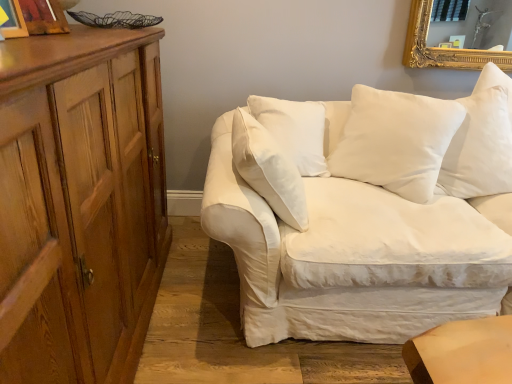
Question: Is white cotton pillow at center, acting as the first pillow starting from the left, completely or partially outside of wooden picture frame at upper left, the 1th picture frame in the front-to-back sequence?

Choices:
 (A) yes
 (B) no

Answer: (A)

Question: Is white cotton pillow at center, the 2th pillow from the right, beside wooden picture frame at upper left, acting as the second picture frame starting from the back?

Choices:
 (A) yes
 (B) no

Answer: (B)

Question: Does white cotton pillow at center, the 2th pillow from the right, have a lesser width compared to wooden picture frame at upper left, the 1th picture frame in the front-to-back sequence?

Choices:
 (A) no
 (B) yes

Answer: (A)

Question: Is white cotton pillow at center, acting as the first pillow starting from the left, further to the viewer compared to wooden picture frame at upper left, acting as the second picture frame starting from the back?

Choices:
 (A) no
 (B) yes

Answer: (B)

Question: Is white cotton pillow at center, acting as the first pillow starting from the left, oriented towards wooden picture frame at upper left, the 1th picture frame in the front-to-back sequence?

Choices:
 (A) yes
 (B) no

Answer: (A)

Question: Does white cotton pillow at center, acting as the first pillow starting from the left, contain wooden picture frame at upper left, the 1th picture frame in the front-to-back sequence?

Choices:
 (A) no
 (B) yes

Answer: (A)

Question: Is white soft pillow at upper right, the 2th pillow in the left-to-right sequence, inside wooden picture frame at upper left, the 1th picture frame when ordered from back to front?

Choices:
 (A) no
 (B) yes

Answer: (A)

Question: Are wooden picture frame at upper left, the 1th picture frame when ordered from back to front, and white soft pillow at upper right, the 2th pillow in the left-to-right sequence, beside each other?

Choices:
 (A) yes
 (B) no

Answer: (B)

Question: Considering the relative sizes of wooden picture frame at upper left, the 1th picture frame when ordered from back to front, and white soft pillow at upper right, arranged as the first pillow when viewed from the right, in the image provided, is wooden picture frame at upper left, the 1th picture frame when ordered from back to front, wider than white soft pillow at upper right, arranged as the first pillow when viewed from the right,?

Choices:
 (A) yes
 (B) no

Answer: (B)

Question: Considering the relative sizes of wooden picture frame at upper left, the 1th picture frame when ordered from back to front, and white soft pillow at upper right, the 2th pillow in the left-to-right sequence, in the image provided, is wooden picture frame at upper left, the 1th picture frame when ordered from back to front, smaller than white soft pillow at upper right, the 2th pillow in the left-to-right sequence,?

Choices:
 (A) yes
 (B) no

Answer: (A)

Question: Does wooden picture frame at upper left, the 1th picture frame when ordered from back to front, come behind white soft pillow at upper right, the 2th pillow in the left-to-right sequence?

Choices:
 (A) no
 (B) yes

Answer: (A)

Question: Is wooden picture frame at upper left, which is the second picture frame from front to back, not near white soft pillow at upper right, the 2th pillow in the left-to-right sequence?

Choices:
 (A) yes
 (B) no

Answer: (A)

Question: From the image's perspective, does white cotton couch at center appear higher than wooden picture frame at upper left, the 1th picture frame when ordered from back to front?

Choices:
 (A) no
 (B) yes

Answer: (A)